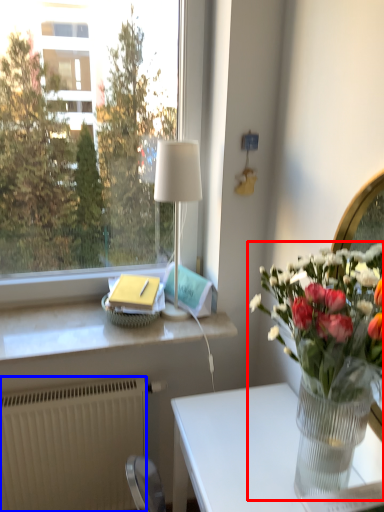
Question: Which point is closer to the camera, houseplant (highlighted by a red box) or radiator (highlighted by a blue box)?

Choices:
 (A) houseplant
 (B) radiator

Answer: (A)